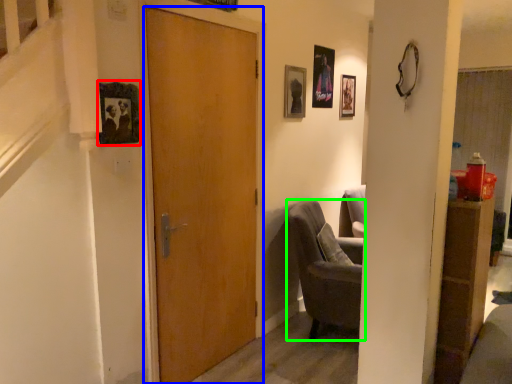
Question: Which object is the farthest from picture frame (highlighted by a red box)? Choose among these: door (highlighted by a blue box) or chair (highlighted by a green box).

Choices:
 (A) door
 (B) chair

Answer: (B)